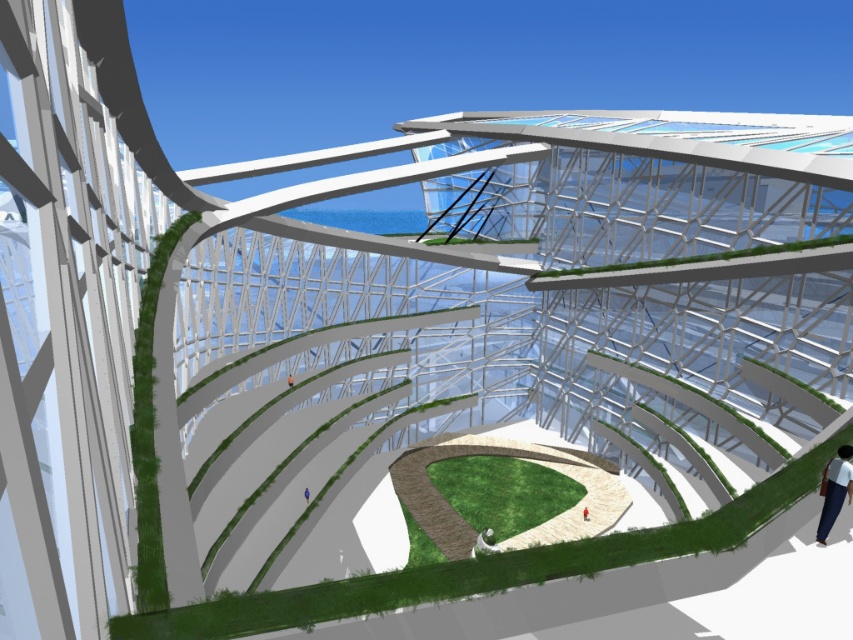
Question: Does green grass at center appear on the left side of white fabric pants at lower right?

Choices:
 (A) no
 (B) yes

Answer: (B)

Question: Which of the following is the farthest from the observer?

Choices:
 (A) (526, 508)
 (B) (827, 472)

Answer: (A)

Question: Which of the following is the farthest from the observer?

Choices:
 (A) green grass at center
 (B) white fabric pants at lower right

Answer: (A)

Question: Does green grass at center appear over white fabric pants at lower right?

Choices:
 (A) no
 (B) yes

Answer: (A)

Question: Which point is closer to the camera?

Choices:
 (A) (822, 508)
 (B) (502, 488)

Answer: (A)

Question: Is green grass at center below white fabric pants at lower right?

Choices:
 (A) no
 (B) yes

Answer: (B)